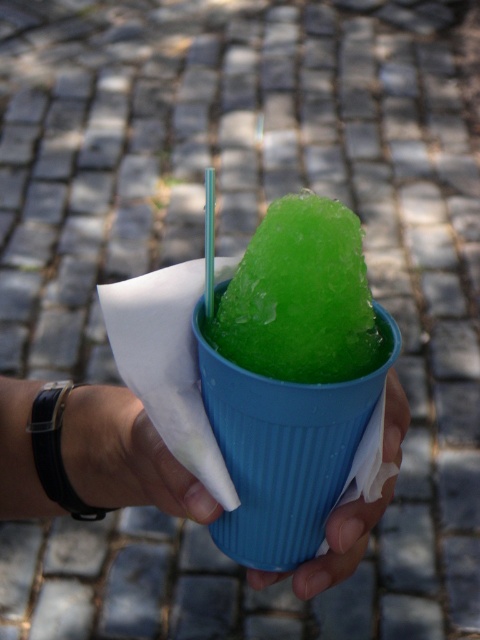
In the scene shown: You are standing at the point labeled as point [127,476]. You want to place a small marker exactly 20 inches in front of you. Based on the scene description, will the marker be placed on the cobblestone pavement or the cup?

The point labeled as point [127,476] is 20.61 inches away from the viewer. Since the marker is placed 20 inches in front of you, it would be very close to the point and likely still on the cobblestone pavement, as the cup is part of the scene but not necessarily in that exact location unless specified.

You are a delivery person who needs to place a package on the cobblestone pavement in the background. The package must be placed exactly where the green frosted ice at center is located. What are the coordinates of the location where you should place the package?

The coordinates for the green frosted ice at center are at point [300,298], so you should place the package at those coordinates.